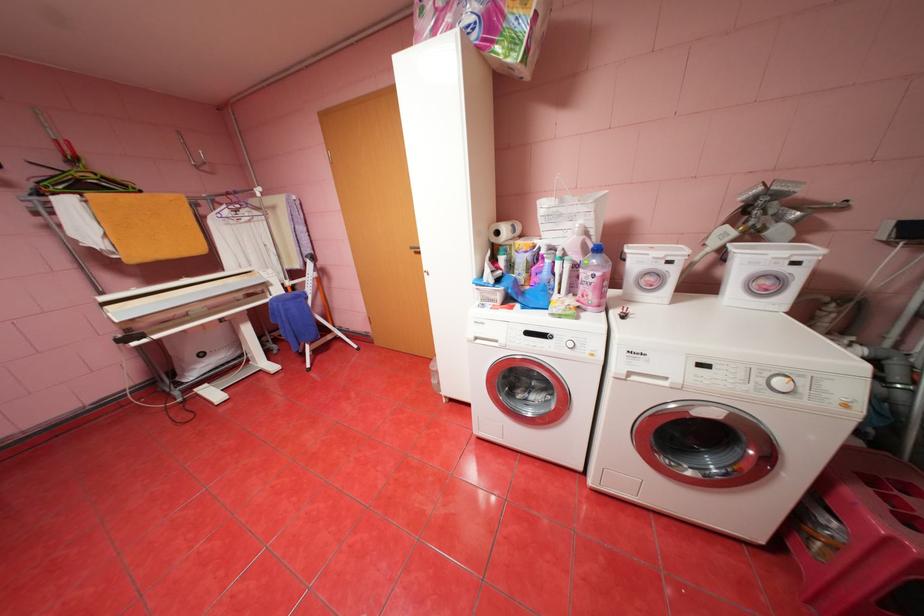
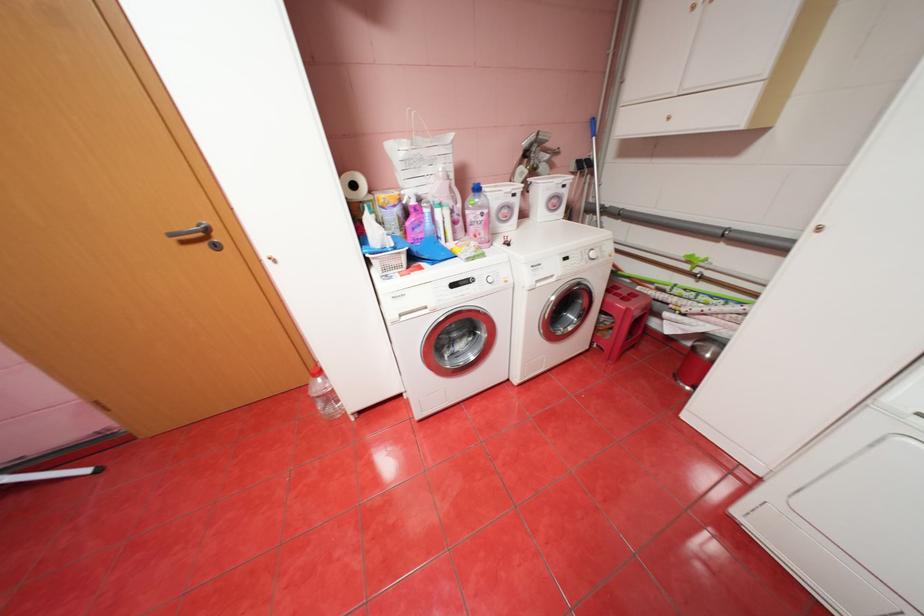
In the second image, find the point that corresponds to (788,382) in the first image.

(602, 254)